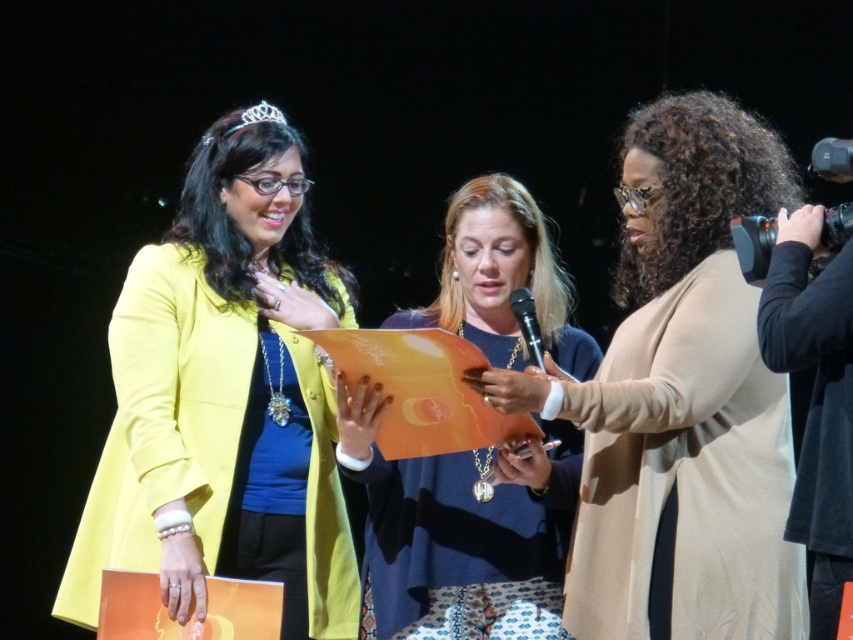
Between matte yellow jacket at center and matte orange paper at center, which one appears on the left side from the viewer's perspective?

matte yellow jacket at center

Where is `matte yellow jacket at center`? matte yellow jacket at center is located at coordinates click(225, 397).

Does beige fabric coat at center appear under matte orange paper at center?

No, beige fabric coat at center is not below matte orange paper at center.

Can you confirm if beige fabric coat at center is thinner than matte orange paper at center?

In fact, beige fabric coat at center might be wider than matte orange paper at center.

The width and height of the screenshot is (853, 640). Describe the element at coordinates (682, 400) in the screenshot. I see `beige fabric coat at center` at that location.

Where is `beige fabric coat at center`? This screenshot has width=853, height=640. beige fabric coat at center is located at coordinates (682, 400).

Which is above, matte yellow jacket at center or beige fabric coat at center?

beige fabric coat at center is above.

Which is in front, point (321, 360) or point (566, 419)?

Point (566, 419) is in front.

The height and width of the screenshot is (640, 853). Find the location of `matte yellow jacket at center`. matte yellow jacket at center is located at coordinates (225, 397).